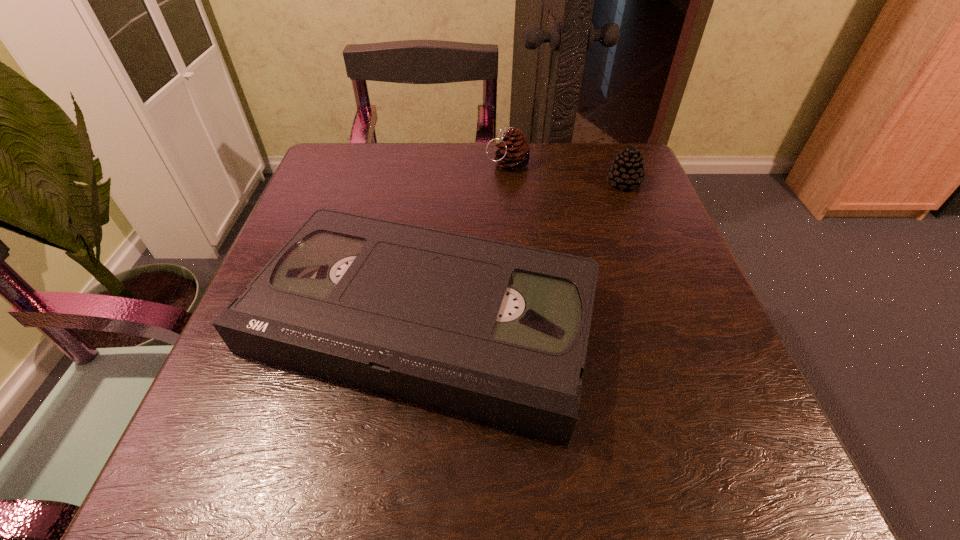
Locate an element on the screen. blank space located 0.380m on the back of the shortest object is located at coordinates (443, 141).

Locate an element on the screen. object present at the near edge is located at coordinates (498, 332).

Where is `object located at the left edge`? This screenshot has width=960, height=540. object located at the left edge is located at coordinates pos(498,332).

Locate an element on the screen. object located at the right edge is located at coordinates (627, 170).

Where is `object that is at the near left corner`? This screenshot has width=960, height=540. object that is at the near left corner is located at coordinates (498, 332).

The image size is (960, 540). I want to click on object positioned at the far right corner, so click(x=627, y=170).

You are a GUI agent. You are given a task and a screenshot of the screen. Output one action in this format:
    pyautogui.click(x=<x>, y=<y>)
    Task: Click on the vacant space at the far edge of the desktop
    This screenshot has width=960, height=540.
    Given the screenshot: What is the action you would take?
    pyautogui.click(x=550, y=184)

I want to click on free space at the left edge of the desktop, so click(233, 354).

In the image, there is a desktop. At what (x,y) coordinates should I click in order to perform the action: click on vacant space at the right edge. Please return your answer as a coordinate pair (x, y). Looking at the image, I should click on (704, 355).

The image size is (960, 540). Find the location of `free space at the near left corner of the desktop`. free space at the near left corner of the desktop is located at coordinates (234, 442).